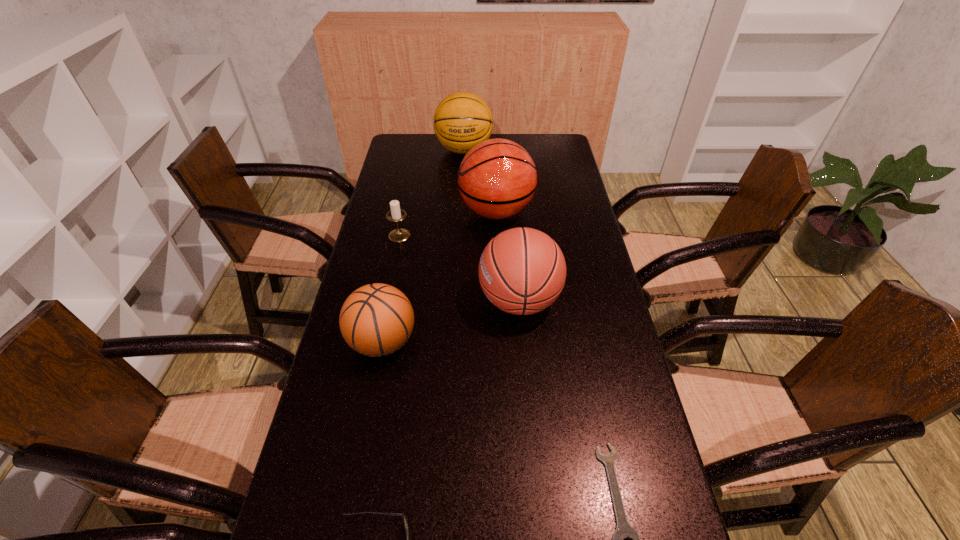
Image resolution: width=960 pixels, height=540 pixels. What are the coordinates of `the second farthest basketball` in the screenshot? It's located at (497, 178).

At what (x,y) coordinates should I click in order to perform the action: click on the farthest basketball. Please return your answer as a coordinate pair (x, y). Looking at the image, I should click on (462, 120).

I want to click on the shortest basketball, so click(x=377, y=319).

Find the location of a particular element. Image resolution: width=960 pixels, height=540 pixels. candle holder is located at coordinates (396, 214).

Where is `vacant space located 0.260m on the side with spill of the third nearest basketball`? vacant space located 0.260m on the side with spill of the third nearest basketball is located at coordinates (385, 212).

The image size is (960, 540). What are the coordinates of `vacant space located 0.110m on the side with spill of the third nearest basketball` in the screenshot? It's located at (427, 212).

At what (x,y) coordinates should I click in order to perform the action: click on blank area located on the side with spill of the third nearest basketball. Please return your answer as a coordinate pair (x, y). Looking at the image, I should click on (417, 212).

You are a GUI agent. You are given a task and a screenshot of the screen. Output one action in this format:
    pyautogui.click(x=<x>, y=<y>)
    Task: Click on the blank space located on the surface of the farthest basketball near the brand logo
    The height and width of the screenshot is (540, 960).
    Given the screenshot: What is the action you would take?
    pyautogui.click(x=463, y=183)

At what (x,y) coordinates should I click in order to perform the action: click on vacant space positioned on the right of the shortest basketball. Please return your answer as a coordinate pair (x, y). The width and height of the screenshot is (960, 540). Looking at the image, I should click on (543, 341).

The width and height of the screenshot is (960, 540). I want to click on free space located 0.340m on the right of the third shortest object, so click(513, 235).